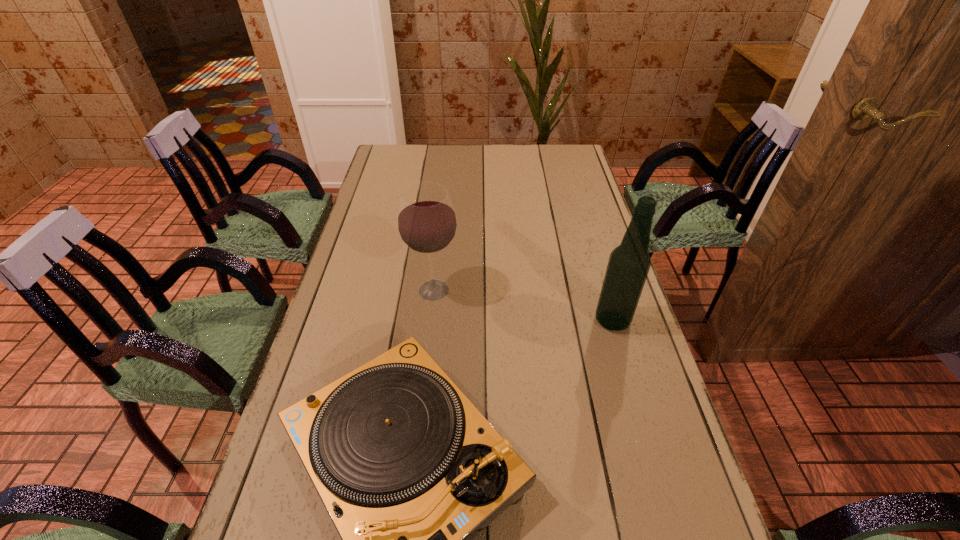
Locate an element on the screen. the right alcohol is located at coordinates (628, 266).

Where is `the second tallest object`? the second tallest object is located at coordinates (427, 224).

Where is `the shorter alcohol`? This screenshot has height=540, width=960. the shorter alcohol is located at coordinates (427, 224).

Where is `vacant space located on the back of the right alcohol`? The image size is (960, 540). vacant space located on the back of the right alcohol is located at coordinates (602, 283).

Locate an element on the screen. free space located 0.170m on the back of the second tallest object is located at coordinates (440, 238).

The height and width of the screenshot is (540, 960). I want to click on object that is at the right edge, so click(x=628, y=266).

Find the location of a particular element. The width and height of the screenshot is (960, 540). vacant region at the far edge of the desktop is located at coordinates (535, 167).

Identify the location of vacant space at the left edge of the desktop. (380, 282).

Where is `vacant space at the right edge of the desktop`? The height and width of the screenshot is (540, 960). vacant space at the right edge of the desktop is located at coordinates (643, 441).

The width and height of the screenshot is (960, 540). What are the coordinates of `vacant space at the far right corner of the desktop` in the screenshot? It's located at (560, 147).